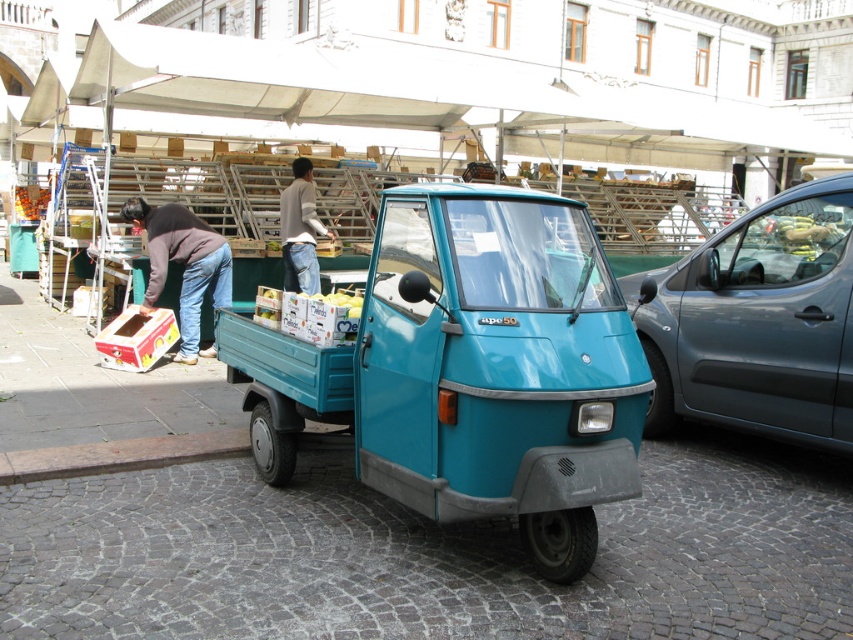
You are standing at the origin point of the image coordinate system. The teal matte truck at center is located at point (469, 369). Can you tell me the coordinates of the teal matte truck at center?

The teal matte truck at center is located at point (469, 369).

You are a delivery person who needs to load a package into the metallic gray car at right. The package is too big to fit through the door of the jeans at left. Where should you place it?

The metallic gray car at right is larger in size than the jeans at left, so the package should be placed in the metallic gray car at right since it has more space.